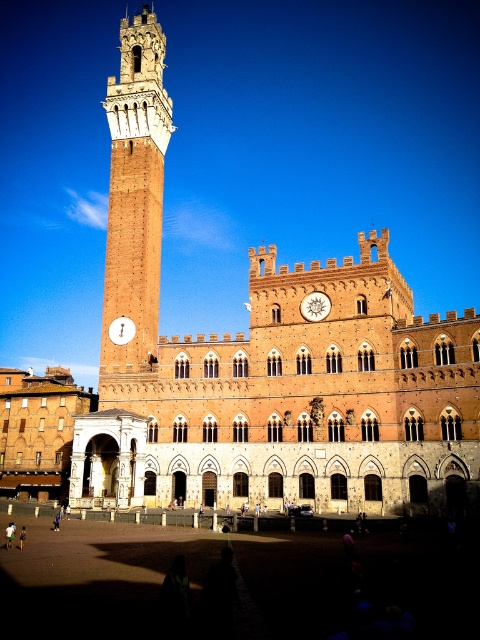
You are standing in front of the historic building complex and looking at two points marked on the structure. The first point is at coordinates point (151, 298) and the second is at point (118, 342). Which point appears closer to you?

Point (151, 298) is further to the camera than point (118, 342), so the second point appears closer to you.

You are standing at point (148, 236) and want to reach the clock tower on the left side of the building. The distance between you and the clock tower is 69.09 meters. If you walk at a speed of 1.5 meters per second, how many seconds will it take you to reach the clock tower?

The distance between you and the clock tower is 69.09 meters. At a walking speed of 1.5 meters per second, it will take 69.09 divided by 1.5, which equals approximately 46.06 seconds to reach the clock tower.

You are standing at the entrance of the historic building complex. You want to locate the brown stone building at center. According to the coordinates provided, where should you look relative to your current position?

The brown stone building at center is located at coordinates point (264, 362), which means it is positioned slightly to the right and above your current position.